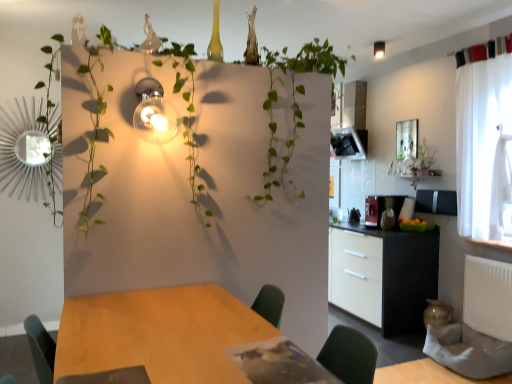
Question: Considering the relative positions of wooden table at center and matte glass light fixture at upper right, which appears as the 2th light fixture when viewed from the front, in the image provided, is wooden table at center in front of matte glass light fixture at upper right, which appears as the 2th light fixture when viewed from the front,?

Choices:
 (A) yes
 (B) no

Answer: (A)

Question: From a real-world perspective, is wooden table at center located higher than matte glass light fixture at upper right, the second light fixture positioned from the bottom?

Choices:
 (A) no
 (B) yes

Answer: (A)

Question: From the image's perspective, would you say wooden table at center is shown under matte glass light fixture at upper right, arranged as the first light fixture when viewed from the top?

Choices:
 (A) yes
 (B) no

Answer: (A)

Question: Does wooden table at center have a greater height compared to matte glass light fixture at upper right, which appears as the 2th light fixture when viewed from the front?

Choices:
 (A) no
 (B) yes

Answer: (B)

Question: Are wooden table at center and matte glass light fixture at upper right, which appears as the 2th light fixture when viewed from the front, making contact?

Choices:
 (A) no
 (B) yes

Answer: (A)

Question: Does wooden table at center have a greater width compared to matte glass light fixture at upper right, which appears as the 2th light fixture when viewed from the front?

Choices:
 (A) no
 (B) yes

Answer: (B)

Question: Does matte glass light fixture at upper right, which appears as the 2th light fixture when viewed from the front, appear on the right side of black matte cabinet at right?

Choices:
 (A) yes
 (B) no

Answer: (A)

Question: Does matte glass light fixture at upper right, which is the 1th light fixture in back-to-front order, appear on the left side of black matte cabinet at right?

Choices:
 (A) yes
 (B) no

Answer: (B)

Question: Is the position of matte glass light fixture at upper right, the first light fixture positioned from the right, less distant than that of black matte cabinet at right?

Choices:
 (A) yes
 (B) no

Answer: (B)

Question: From a real-world perspective, is matte glass light fixture at upper right, which is the second light fixture from left to right, positioned over black matte cabinet at right based on gravity?

Choices:
 (A) no
 (B) yes

Answer: (B)

Question: Considering the relative sizes of matte glass light fixture at upper right, the first light fixture positioned from the right, and black matte cabinet at right in the image provided, is matte glass light fixture at upper right, the first light fixture positioned from the right, shorter than black matte cabinet at right?

Choices:
 (A) no
 (B) yes

Answer: (B)

Question: Is matte glass light fixture at upper right, arranged as the first light fixture when viewed from the top, facing towards black matte cabinet at right?

Choices:
 (A) yes
 (B) no

Answer: (B)

Question: Does green leafy plant at center appear on the right side of matte glass light fixture at upper right, which is the second light fixture from left to right?

Choices:
 (A) yes
 (B) no

Answer: (B)